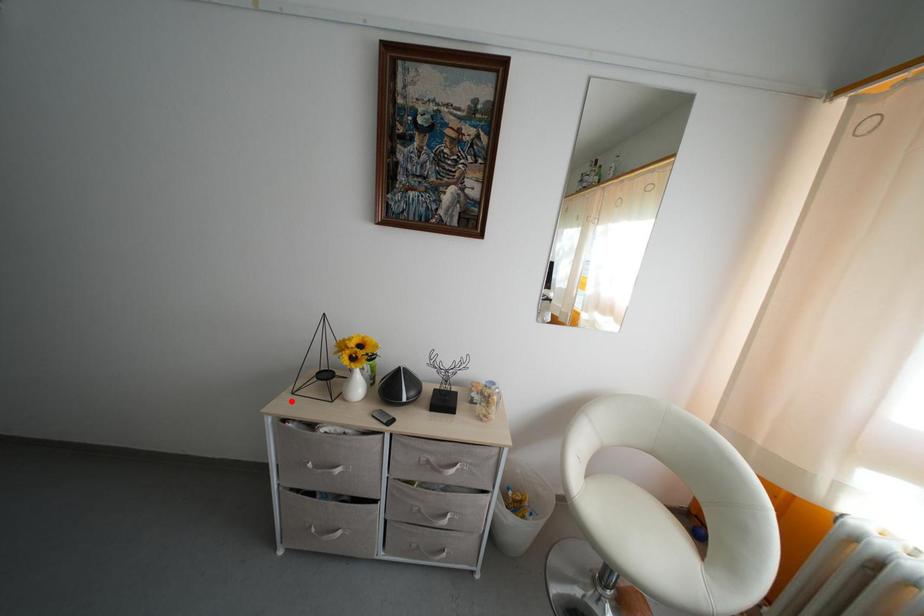
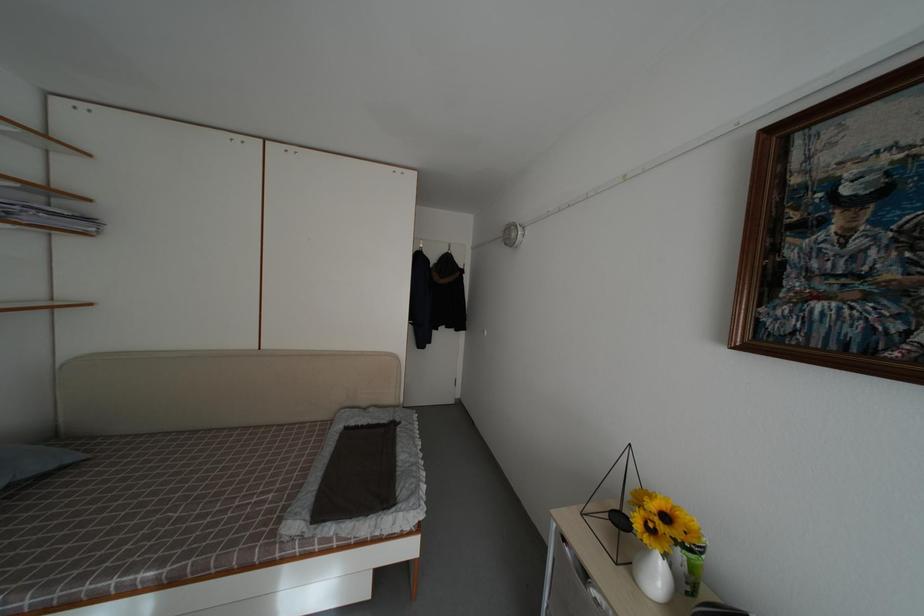
Where in the second image is the point corresponding to the highlighted location from the first image?

(581, 517)